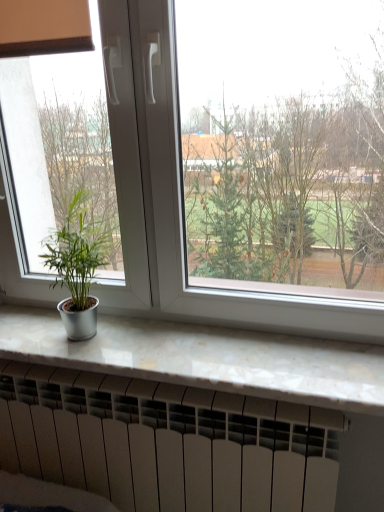
Where is `vacant area that lies to the right of green matte plant at left`? Image resolution: width=384 pixels, height=512 pixels. vacant area that lies to the right of green matte plant at left is located at coordinates (143, 344).